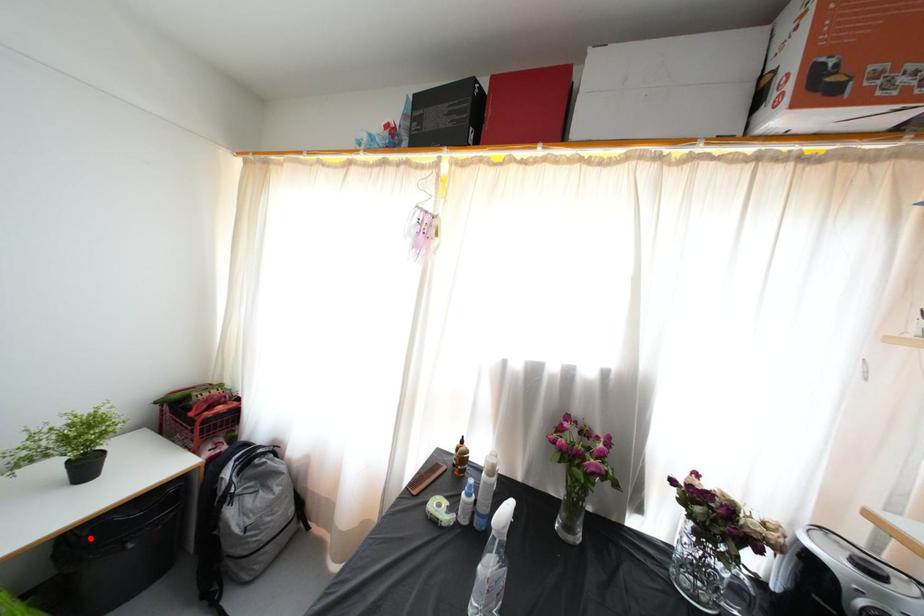
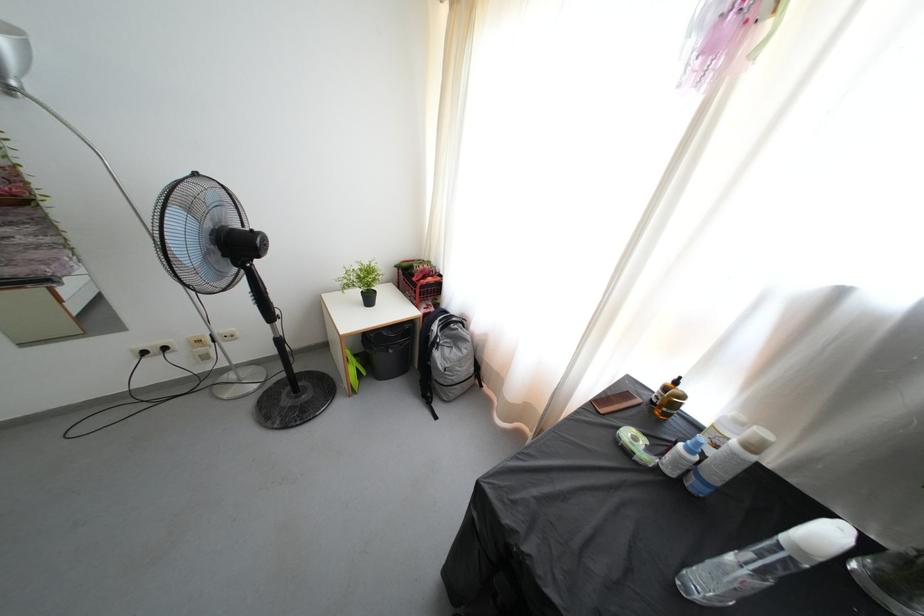
In the second image, find the point that corresponds to the highlighted location in the first image.

(378, 341)